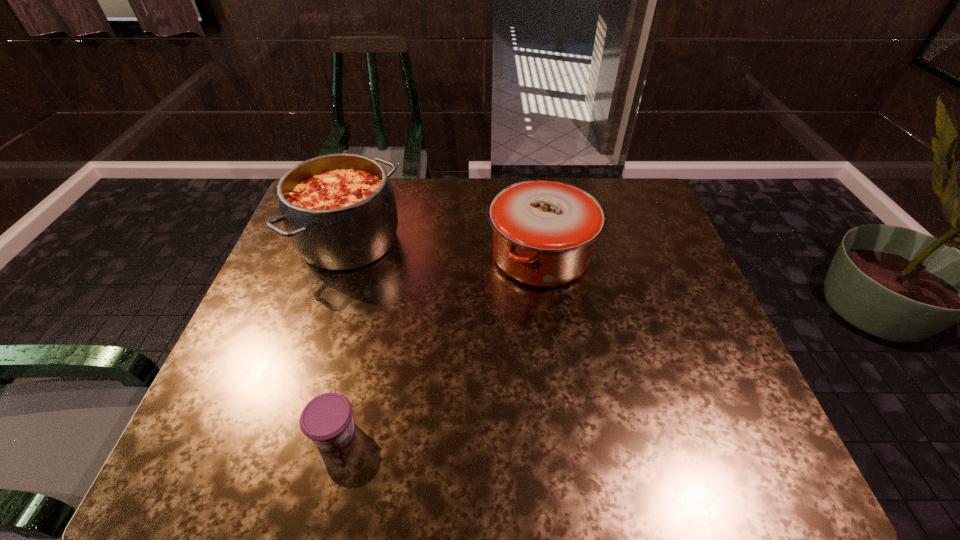
Where is `free area in between the rightmost object and the left casserole`? This screenshot has height=540, width=960. free area in between the rightmost object and the left casserole is located at coordinates (444, 248).

Where is `unoccupied area between the rightmost object and the left casserole`? This screenshot has width=960, height=540. unoccupied area between the rightmost object and the left casserole is located at coordinates (444, 248).

At what (x,y) coordinates should I click in order to perform the action: click on object identified as the second closest to the left casserole. Please return your answer as a coordinate pair (x, y). The image size is (960, 540). Looking at the image, I should click on (327, 420).

Select which object is the second closest to the right casserole. Please provide its 2D coordinates. Your answer should be formatted as a tuple, i.e. [(x, y)], where the tuple contains the x and y coordinates of a point satisfying the conditions above.

[(327, 420)]

Locate an element on the screen. vacant region that satisfies the following two spatial constraints: 1. on the front side of the left casserole; 2. on the right side of the right casserole is located at coordinates (344, 256).